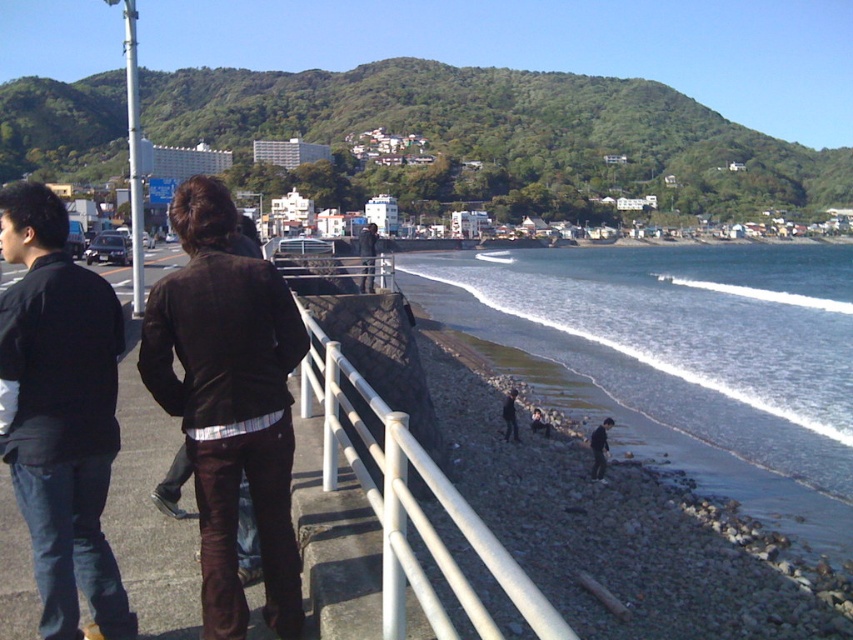
Question: Which point is closer to the camera taking this photo?

Choices:
 (A) (804, 396)
 (B) (360, 285)

Answer: (A)

Question: Is black matte jacket at left below dark brown leather jacket at center?

Choices:
 (A) no
 (B) yes

Answer: (B)

Question: Which of the following is the farthest from the observer?

Choices:
 (A) black matte jacket at left
 (B) clear water at beach right
 (C) dark brown leather jacket at center

Answer: (C)

Question: Can you confirm if clear water at beach right is bigger than white plastic rail at lower center?

Choices:
 (A) yes
 (B) no

Answer: (A)

Question: Based on their relative distances, which object is farther from the dark brown leather jacket at center?

Choices:
 (A) dark brown leather jacket at left
 (B) black matte jacket at left
 (C) clear water at beach right
 (D) white plastic rail at lower center

Answer: (C)

Question: Where is dark brown leather jacket at left located in relation to black matte jacket at left in the image?

Choices:
 (A) above
 (B) below

Answer: (B)